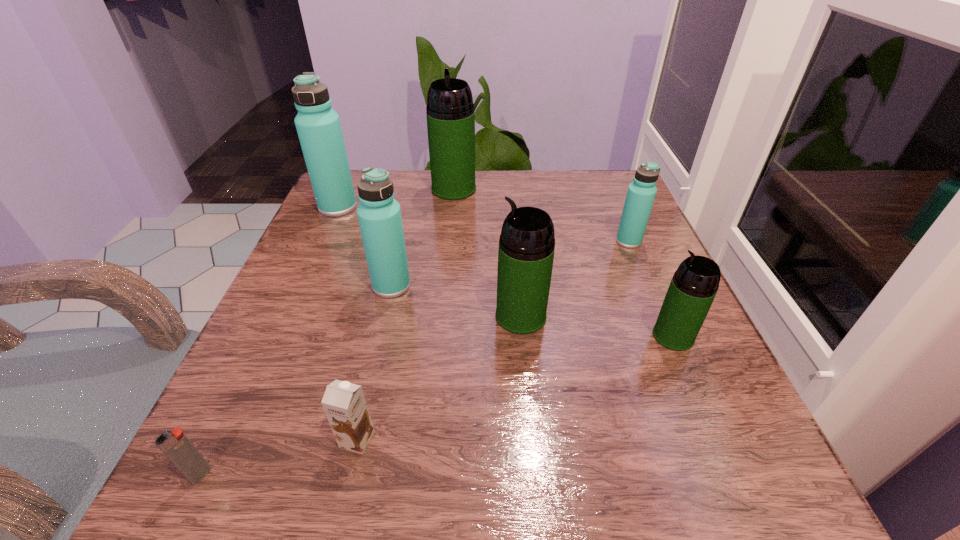
Identify the location of igniter that is positioned at the left edge. The width and height of the screenshot is (960, 540). (177, 447).

I want to click on object at the far left corner, so click(318, 126).

What are the coordinates of `object that is at the near left corner` in the screenshot? It's located at (177, 447).

The height and width of the screenshot is (540, 960). What are the coordinates of `vacant point at the far edge` in the screenshot? It's located at [528, 201].

Locate an element on the screen. Image resolution: width=960 pixels, height=540 pixels. free region at the near edge of the desktop is located at coordinates (550, 513).

Image resolution: width=960 pixels, height=540 pixels. I want to click on free location at the left edge of the desktop, so click(305, 318).

Where is `vacant position at the right edge of the desktop`? This screenshot has height=540, width=960. vacant position at the right edge of the desktop is located at coordinates (587, 249).

Locate an element on the screen. free point at the far left corner is located at coordinates (359, 205).

You are a GUI agent. You are given a task and a screenshot of the screen. Output one action in this format:
    pyautogui.click(x=<x>, y=<y>)
    Task: Click on the vacant space at the far right corner of the desktop
    The height and width of the screenshot is (540, 960).
    Given the screenshot: What is the action you would take?
    pyautogui.click(x=596, y=209)

Identify the location of vacant region between the chocolate milk and the smallest green thermos bottle. This screenshot has height=540, width=960. (516, 388).